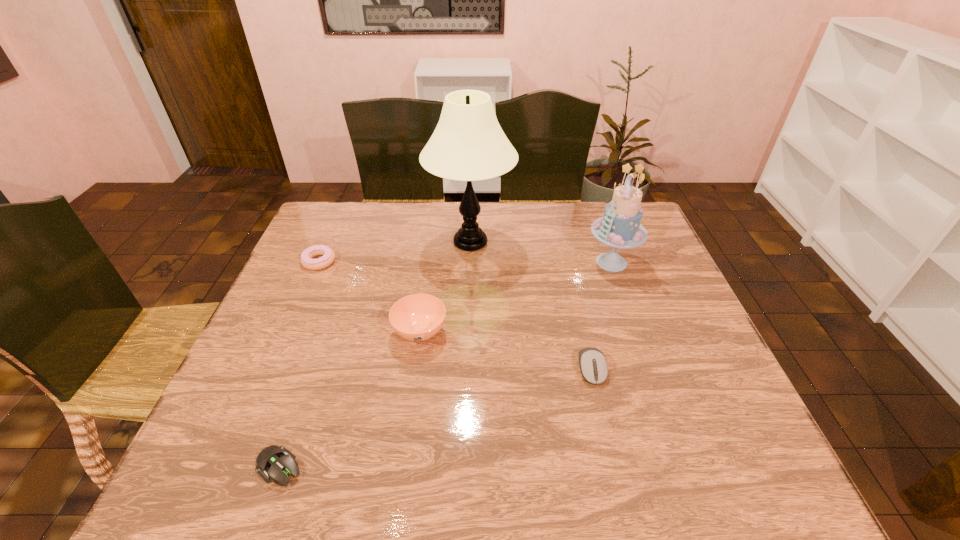
Identify the location of vacant space located 0.240m with a ladder on the side of the fifth shortest object. (506, 262).

In order to click on vacant space located 0.150m with a ladder on the side of the fifth shortest object in this screenshot , I will do (536, 262).

Locate an element on the screen. blank space located with a ladder on the side of the fifth shortest object is located at coordinates (536, 262).

This screenshot has width=960, height=540. Identify the location of free space located 0.330m on the left of the soup bowl. click(x=262, y=332).

Image resolution: width=960 pixels, height=540 pixels. What are the coordinates of `free spot located 0.150m on the back of the doughnut` in the screenshot? It's located at (335, 224).

Identify the location of free space located on the wheel side of the taller computer mouse. (615, 470).

The image size is (960, 540). I want to click on free space located on the right of the left computer mouse, so click(x=448, y=467).

Locate an element on the screen. This screenshot has height=540, width=960. object at the far edge is located at coordinates (468, 144).

You are a GUI agent. You are given a task and a screenshot of the screen. Output one action in this format:
    pyautogui.click(x=<x>, y=<y>)
    Task: Click on the object at the near edge
    The width and height of the screenshot is (960, 540).
    Given the screenshot: What is the action you would take?
    pyautogui.click(x=275, y=462)

What are the coordinates of `doughnut located in the left edge section of the desktop` in the screenshot? It's located at (328, 257).